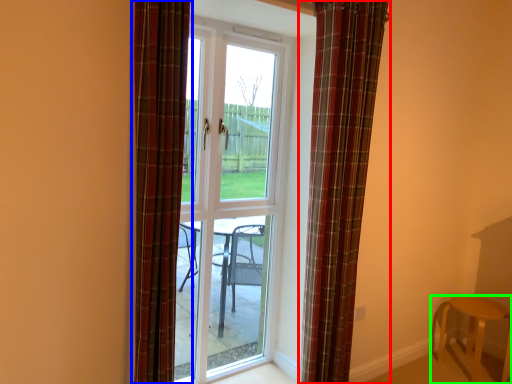
Question: Which is nearer to the curtain (highlighted by a red box)? curtain (highlighted by a blue box) or furniture (highlighted by a green box).

Choices:
 (A) curtain
 (B) furniture

Answer: (A)